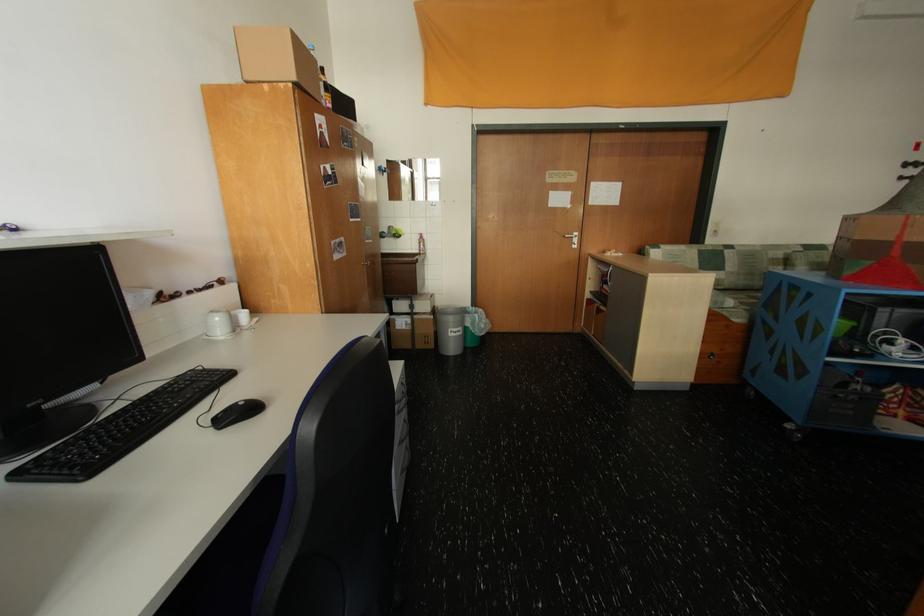
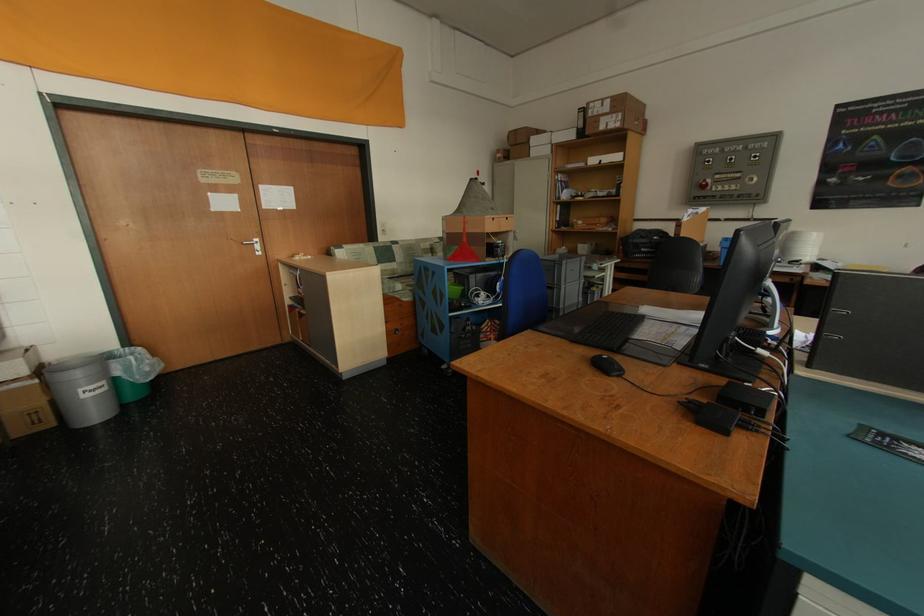
Find the pixel in the second image that matches point (484, 315) in the first image.

(140, 359)